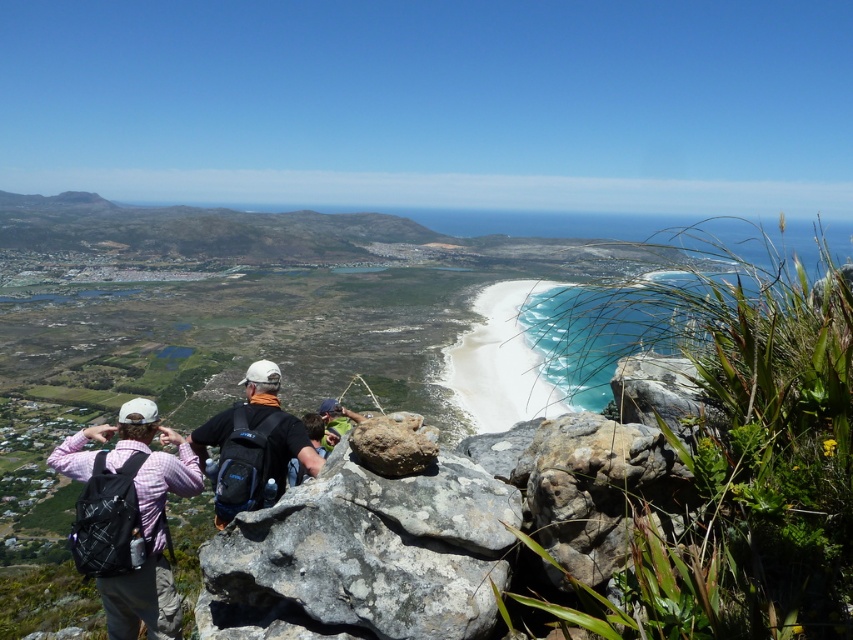
You are a photographer holding a camera and want to capture a closeup of the gray rough rock at center. Based on the scene, can you get close enough to the rock to take the photo without moving the camera more than 7 meters?

The gray rough rock at center and camera are 7.67 meters apart, which is slightly more than 7 meters. Therefore, you cannot get close enough to the rock to take the photo without moving the camera more than 7 meters.

You are a hiker standing on the gray rough rock at center and looking at the matte black backpack at center. Which object is taller?

The matte black backpack at center is taller than the gray rough rock at center.

Consider the image. You are standing at point (260, 413) and want to move to the coastal view in the distance. Is the point (302, 573) between you and the coastal view?

Yes, point (302, 573) is between you at point (260, 413) and the coastal view because it is in front of your current position.